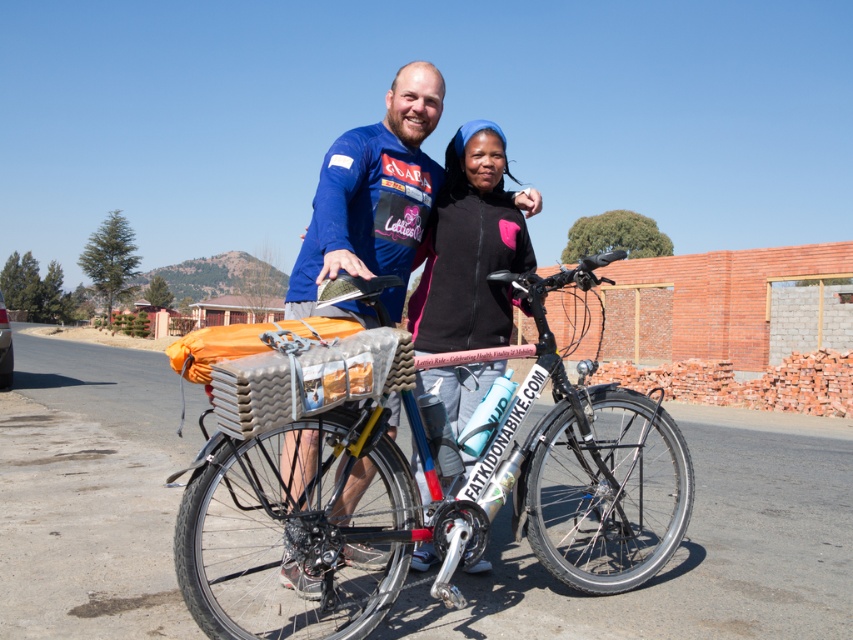
Question: Observing the image, what is the correct spatial positioning of silver metallic bicycle at center in reference to blue fabric shirt at center?

Choices:
 (A) left
 (B) right

Answer: (B)

Question: Can you confirm if silver metallic bicycle at center is thinner than black fleece jacket at center?

Choices:
 (A) yes
 (B) no

Answer: (B)

Question: Which object is positioned farthest from the black fleece jacket at center?

Choices:
 (A) blue fabric shirt at center
 (B) silver metallic bicycle at center

Answer: (B)

Question: Among these points, which one is nearest to the camera?

Choices:
 (A) (465, 198)
 (B) (286, 598)
 (C) (439, 180)

Answer: (B)

Question: Which object is positioned closest to the blue fabric shirt at center?

Choices:
 (A) black fleece jacket at center
 (B) silver metallic bicycle at center

Answer: (A)

Question: Can you confirm if blue fabric shirt at center is positioned below black fleece jacket at center?

Choices:
 (A) yes
 (B) no

Answer: (A)